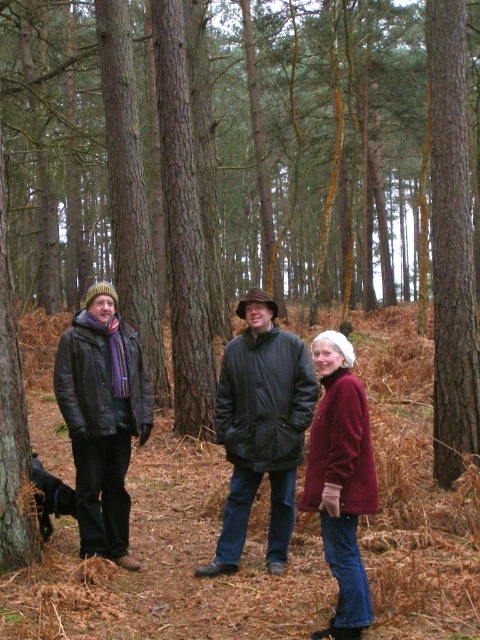
Based on the scene description, where is the brown rough bark tree at center right located in terms of coordinates?

The brown rough bark tree at center right is located at coordinates point (451,244).

You are a photographer trying to capture a photo of the brown rough bark tree at center right and the green rough bark tree at lower left. Which tree should you focus on first if you want to include both in your frame without moving the camera?

You should focus on the green rough bark tree at lower left first because the brown rough bark tree at center right is positioned to its right, so capturing the left side tree first ensures both are in the frame.